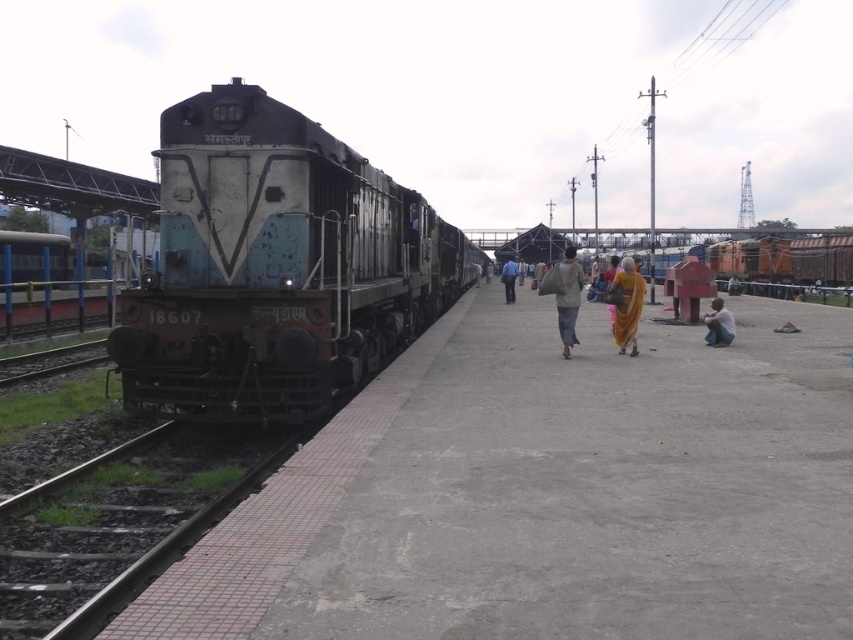
Is light brown fabric bag at center wider than blue fabric bag at center?

Yes.

Does point (567, 294) come in front of point (509, 260)?

Yes.

Is point (577, 284) positioned after point (502, 280)?

That is False.

What are the coordinates of `light brown fabric bag at center` in the screenshot? It's located at (566, 296).

Where is `brown gravel track at lower left`? This screenshot has height=640, width=853. brown gravel track at lower left is located at coordinates (119, 522).

Based on the photo, does brown gravel track at lower left have a greater width compared to blue fabric bag at center?

Incorrect, brown gravel track at lower left's width does not surpass blue fabric bag at center's.

Which is behind, point (155, 465) or point (509, 273)?

Positioned behind is point (509, 273).

This screenshot has width=853, height=640. Identify the location of brown gravel track at lower left. (119, 522).

Describe the element at coordinates (274, 266) in the screenshot. I see `dirty metal train at center` at that location.

Between dirty metal train at center and brown gravel track at lower left, which one is positioned lower?

brown gravel track at lower left

Does point (241, 301) come in front of point (4, 621)?

That is False.

Find the location of `dirty metal train at center`. dirty metal train at center is located at coordinates coord(274,266).